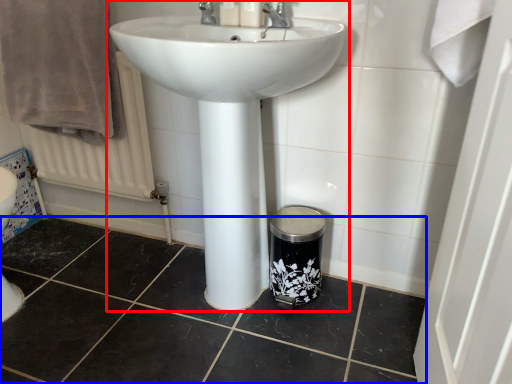
Question: Which object appears farthest to the camera in this image, sink (highlighted by a red box) or tile (highlighted by a blue box)?

Choices:
 (A) sink
 (B) tile

Answer: (B)